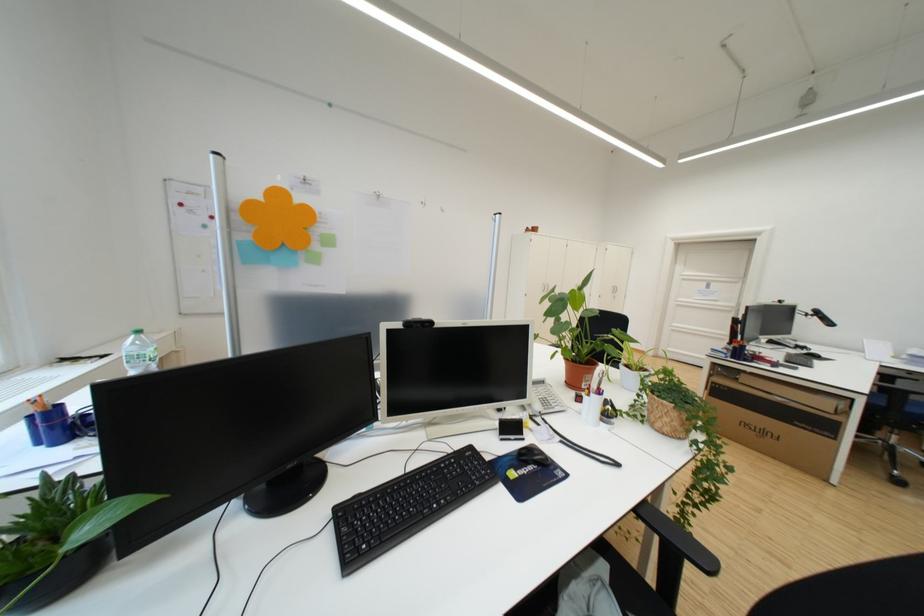
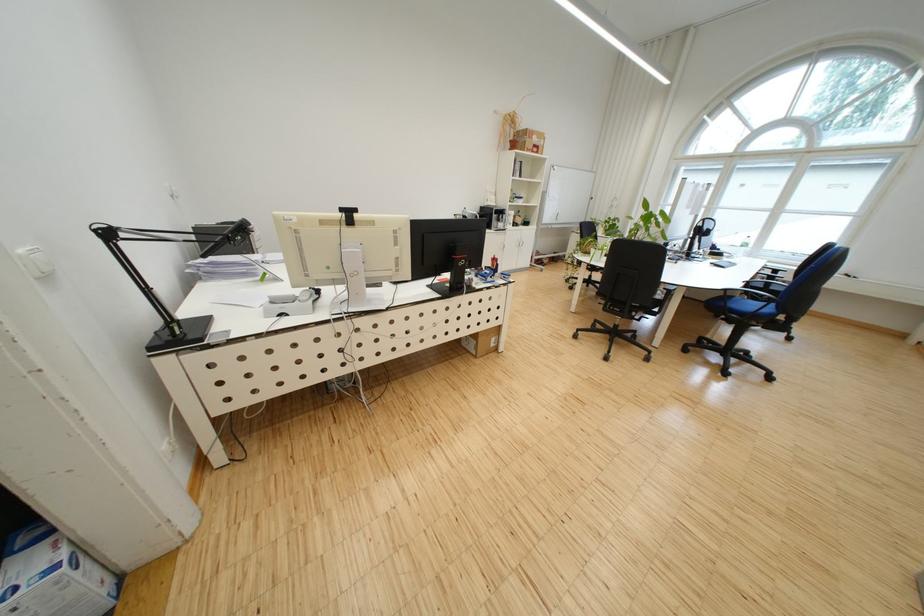
Question: I am providing you with two images of the same scene from different viewpoints. After the viewpoint changes to image2, which objects are now occluded?

Choices:
 (A) black lamp head
 (B) white plant pot
 (C) dark wall switch
 (D) black webcam

Answer: (D)